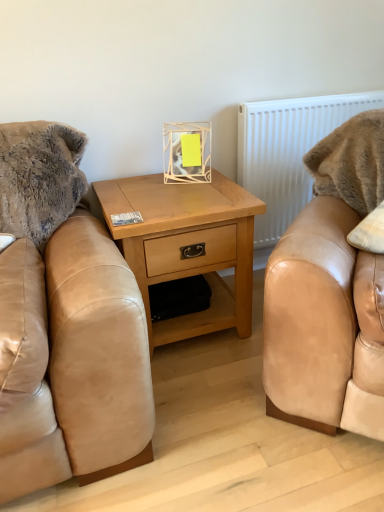
Locate an element on the screen. white plastic radiator at upper right is located at coordinates (288, 151).

What do you see at coordinates (288, 151) in the screenshot? I see `white plastic radiator at upper right` at bounding box center [288, 151].

Where is `light wood/texture nightstand at center`? The width and height of the screenshot is (384, 512). light wood/texture nightstand at center is located at coordinates (189, 243).

The image size is (384, 512). What do you see at coordinates (189, 243) in the screenshot? I see `light wood/texture nightstand at center` at bounding box center [189, 243].

Identify the location of white plastic radiator at upper right. The height and width of the screenshot is (512, 384). [x=288, y=151].

Does white plastic radiator at upper right appear on the left side of light wood/texture nightstand at center?

No.

Is white plastic radiator at upper right positioned before light wood/texture nightstand at center?

No, white plastic radiator at upper right is further to the viewer.

Which point is more distant from viewer, [274,151] or [132,251]?

The point [274,151] is farther.

From the image's perspective, does white plastic radiator at upper right appear lower than light wood/texture nightstand at center?

No.

From a real-world perspective, between white plastic radiator at upper right and light wood/texture nightstand at center, who is vertically higher?

white plastic radiator at upper right is physically above.

Which of these two, white plastic radiator at upper right or light wood/texture nightstand at center, is wider?

With larger width is light wood/texture nightstand at center.

From the picture: Can you confirm if white plastic radiator at upper right is shorter than light wood/texture nightstand at center?

Incorrect, the height of white plastic radiator at upper right does not fall short of that of light wood/texture nightstand at center.

Who is bigger, white plastic radiator at upper right or light wood/texture nightstand at center?

light wood/texture nightstand at center.

Is white plastic radiator at upper right inside or outside of light wood/texture nightstand at center?

white plastic radiator at upper right is not enclosed by light wood/texture nightstand at center.

Does white plastic radiator at upper right touch light wood/texture nightstand at center?

No.

Could you tell me if white plastic radiator at upper right is turned towards light wood/texture nightstand at center?

No.

What's the angular difference between white plastic radiator at upper right and light wood/texture nightstand at center's facing directions?

white plastic radiator at upper right and light wood/texture nightstand at center are facing 0.562 degrees away from each other.

Measure the distance between white plastic radiator at upper right and light wood/texture nightstand at center.

white plastic radiator at upper right is 20.28 inches away from light wood/texture nightstand at center.

You are a GUI agent. You are given a task and a screenshot of the screen. Output one action in this format:
    pyautogui.click(x=<x>, y=<y>)
    Task: Click on the radiator on the right of the light wood/texture nightstand at center
    Image resolution: width=384 pixels, height=512 pixels.
    Given the screenshot: What is the action you would take?
    pyautogui.click(x=288, y=151)

Is light wood/texture nightstand at center to the left of white plastic radiator at upper right from the viewer's perspective?

Yes.

Which object is closer to the camera taking this photo, light wood/texture nightstand at center or white plastic radiator at upper right?

light wood/texture nightstand at center is in front.

Between point (158, 335) and point (302, 157), which one is positioned behind?

Point (302, 157)

From the image's perspective, which one is positioned higher, light wood/texture nightstand at center or white plastic radiator at upper right?

white plastic radiator at upper right appears higher in the image.

From a real-world perspective, does light wood/texture nightstand at center stand above white plastic radiator at upper right?

No.

Looking at their sizes, would you say light wood/texture nightstand at center is wider or thinner than white plastic radiator at upper right?

In the image, light wood/texture nightstand at center appears to be wider than white plastic radiator at upper right.

In the scene shown: Which of these two, light wood/texture nightstand at center or white plastic radiator at upper right, stands shorter?

With less height is light wood/texture nightstand at center.

Consider the image. Does light wood/texture nightstand at center have a larger size compared to white plastic radiator at upper right?

Correct, light wood/texture nightstand at center is larger in size than white plastic radiator at upper right.

In the scene shown: Choose the correct answer: Is light wood/texture nightstand at center inside white plastic radiator at upper right or outside it?

The correct answer is: outside.

Would you say light wood/texture nightstand at center is a long distance from white plastic radiator at upper right?

That's not correct — light wood/texture nightstand at center is a little close to white plastic radiator at upper right.

Could you tell me if light wood/texture nightstand at center is turned towards white plastic radiator at upper right?

No, light wood/texture nightstand at center is not aimed at white plastic radiator at upper right.

How many degrees apart are the facing directions of light wood/texture nightstand at center and white plastic radiator at upper right?

light wood/texture nightstand at center and white plastic radiator at upper right are facing 0.562 degrees away from each other.

Where is `nightstand below the white plastic radiator at upper right (from a real-world perspective)`? The image size is (384, 512). nightstand below the white plastic radiator at upper right (from a real-world perspective) is located at coordinates (189, 243).

Where is `radiator above the light wood/texture nightstand at center (from a real-world perspective)`? radiator above the light wood/texture nightstand at center (from a real-world perspective) is located at coordinates (288, 151).

Identify the location of radiator above the light wood/texture nightstand at center (from the image's perspective). The image size is (384, 512). (288, 151).